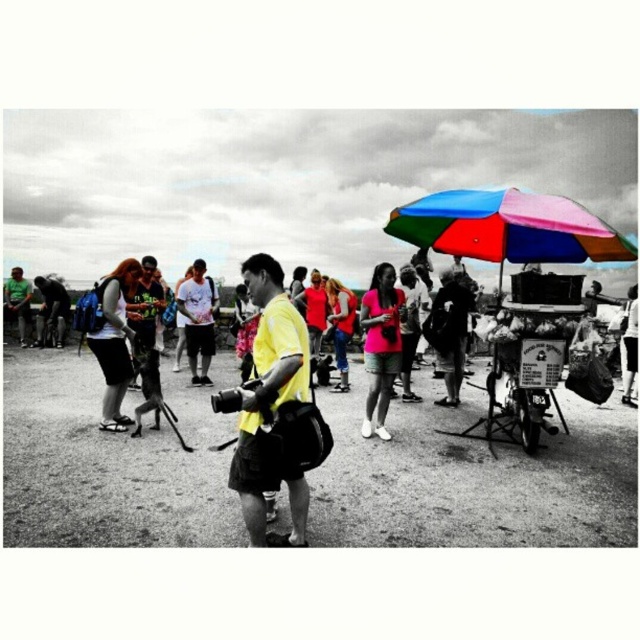
Question: Is yellow matte shirt at center to the left of pink matte shirt at center from the viewer's perspective?

Choices:
 (A) yes
 (B) no

Answer: (A)

Question: Which object is closer to the camera taking this photo?

Choices:
 (A) white printed t-shirt at center
 (B) dirt field at center
 (C) matte black shorts at lower left

Answer: (B)

Question: Which point appears farthest from the camera in this image?

Choices:
 (A) (120, 384)
 (B) (410, 449)
 (C) (182, 324)

Answer: (C)

Question: In this image, where is matte black shorts at lower left located relative to white printed t-shirt at center?

Choices:
 (A) below
 (B) above

Answer: (B)

Question: Which of the following is the closest to the observer?

Choices:
 (A) (112, 369)
 (B) (371, 433)

Answer: (A)

Question: Is multicolored fabric umbrella at upper right to the left of pink matte shirt at center from the viewer's perspective?

Choices:
 (A) no
 (B) yes

Answer: (A)